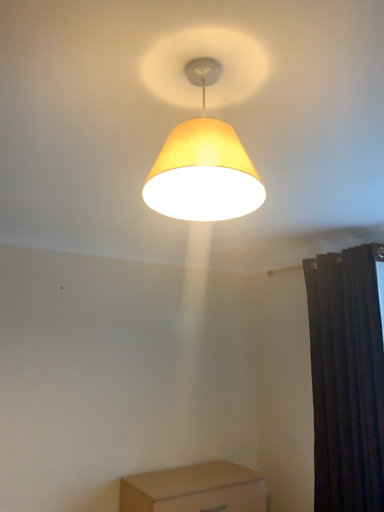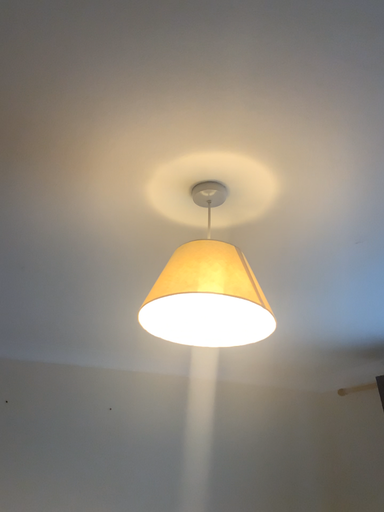
Question: How did the camera likely rotate when shooting the video?

Choices:
 (A) rotated upward
 (B) rotated downward

Answer: (A)